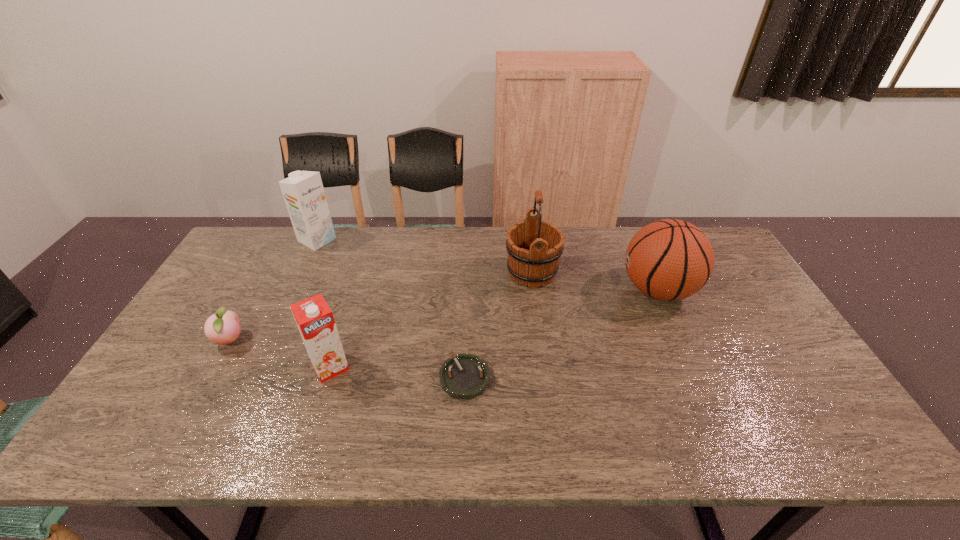
Find the location of a particular element. The width and height of the screenshot is (960, 540). the fifth object from left to right is located at coordinates (534, 247).

At what (x,y) coordinates should I click in order to perform the action: click on the left carton. Please return your answer as a coordinate pair (x, y). The image size is (960, 540). Looking at the image, I should click on (303, 192).

Locate an element on the screen. the farthest object is located at coordinates (303, 192).

Find the location of `basketball`. basketball is located at coordinates (670, 259).

The height and width of the screenshot is (540, 960). What are the coordinates of `the third object from left to right` in the screenshot? It's located at (315, 321).

Identify the location of the shorter carton. (x=315, y=321).

Where is `peach`? peach is located at coordinates coord(223,327).

Locate an element on the screen. Image resolution: width=960 pixels, height=540 pixels. the shortest object is located at coordinates (465, 376).

The width and height of the screenshot is (960, 540). Find the location of `ashtray`. ashtray is located at coordinates (465, 376).

This screenshot has height=540, width=960. What are the coordinates of `vacant space located on the front of the wine bucket` in the screenshot? It's located at click(x=544, y=361).